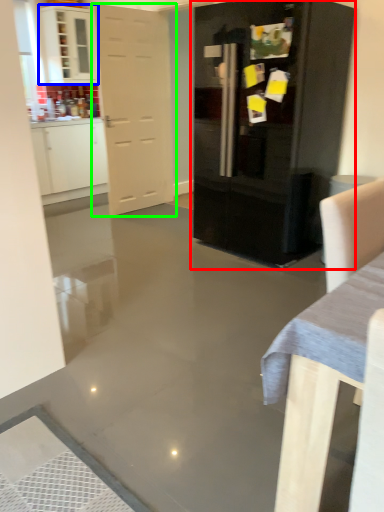
Question: Which object is positioned farthest from cupboard (highlighted by a red box)? Select from cabinetry (highlighted by a blue box) and door (highlighted by a green box).

Choices:
 (A) cabinetry
 (B) door

Answer: (A)